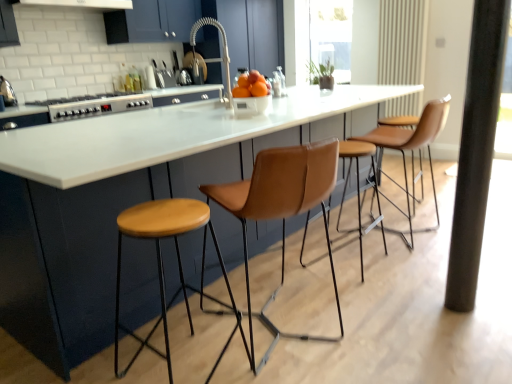
This screenshot has width=512, height=384. I want to click on free region under leather at center, which is counted as the first chair, starting from the front (from a real-world perspective), so click(x=292, y=328).